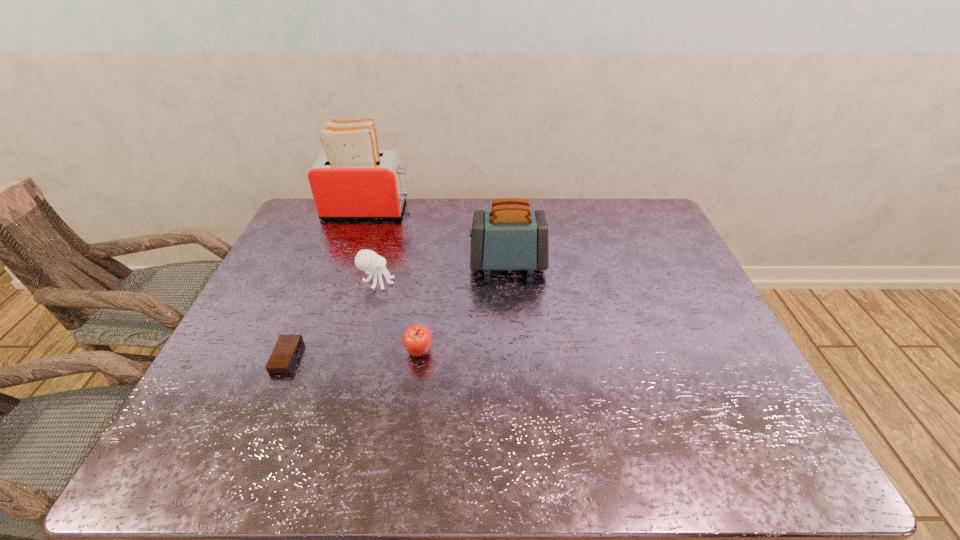
Locate an element on the screen. Image resolution: width=960 pixels, height=540 pixels. free location located 0.290m on the front-facing side of the nearer toaster is located at coordinates (376, 264).

Identify the location of vacant region located on the front-facing side of the nearer toaster. (340, 264).

Locate an element on the screen. Image resolution: width=960 pixels, height=540 pixels. vacant space located on the front-facing side of the octopus is located at coordinates (472, 282).

Find the location of a particular element. The width and height of the screenshot is (960, 540). vacant area situated on the left of the apple is located at coordinates (372, 352).

Where is `vacant space located 0.350m on the front face of the alarm clock`? The height and width of the screenshot is (540, 960). vacant space located 0.350m on the front face of the alarm clock is located at coordinates (439, 357).

Find the location of a particular element. The height and width of the screenshot is (540, 960). object situated at the far edge is located at coordinates (350, 179).

Where is `toaster that is at the left edge`? The height and width of the screenshot is (540, 960). toaster that is at the left edge is located at coordinates (350, 179).

Identify the location of alarm clock located at the left edge. This screenshot has width=960, height=540. (283, 357).

Locate an element on the screen. object that is at the far left corner is located at coordinates (350, 179).

In the image, there is a desktop. Where is `vacant space at the far edge`? Image resolution: width=960 pixels, height=540 pixels. vacant space at the far edge is located at coordinates (418, 225).